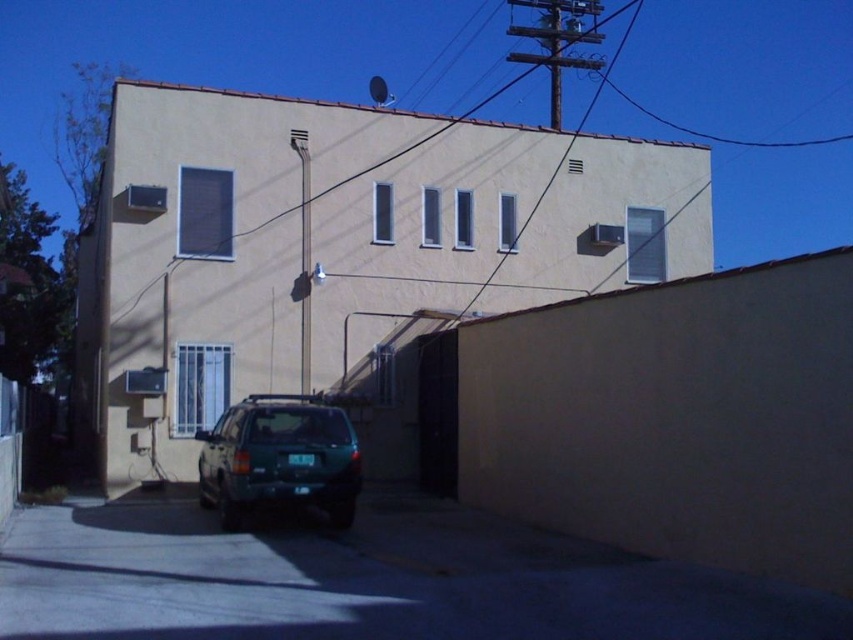
Between point (332, 488) and point (527, 70), which one is positioned in front?

Point (332, 488) is in front.

Does green matte suv at center lie behind brown wire at upper center?

That is False.

Locate an element on the screen. The width and height of the screenshot is (853, 640). green matte suv at center is located at coordinates (279, 458).

Can you confirm if dark gray asphalt at lower center is thinner than brown wire at upper center?

Indeed, dark gray asphalt at lower center has a lesser width compared to brown wire at upper center.

The image size is (853, 640). What do you see at coordinates (367, 580) in the screenshot?
I see `dark gray asphalt at lower center` at bounding box center [367, 580].

Which is behind, point (151, 604) or point (466, 304)?

The point (466, 304) is more distant.

You are a GUI agent. You are given a task and a screenshot of the screen. Output one action in this format:
    pyautogui.click(x=<x>, y=<y>)
    Task: Click on the dark gray asphalt at lower center
    Image resolution: width=853 pixels, height=640 pixels.
    Given the screenshot: What is the action you would take?
    pyautogui.click(x=367, y=580)

Who is shorter, dark gray asphalt at lower center or green matte suv at center?

With less height is dark gray asphalt at lower center.

Between point (300, 593) and point (339, 493), which one is positioned behind?

Point (339, 493)

Where is `dark gray asphalt at lower center`? dark gray asphalt at lower center is located at coordinates (367, 580).